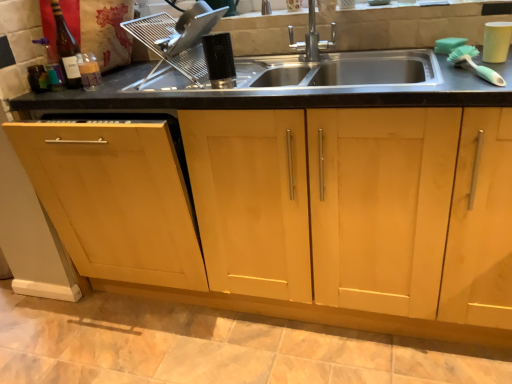
Question: Considering the relative sizes of translucent glass bottle at upper left and satin silver dish rack at upper center, acting as the first appliance starting from the left, in the image provided, is translucent glass bottle at upper left wider than satin silver dish rack at upper center, acting as the first appliance starting from the left,?

Choices:
 (A) no
 (B) yes

Answer: (A)

Question: Does translucent glass bottle at upper left appear on the right side of satin silver dish rack at upper center, which is the 3th appliance from right to left?

Choices:
 (A) no
 (B) yes

Answer: (A)

Question: From the image's perspective, is translucent glass bottle at upper left below satin silver dish rack at upper center, acting as the first appliance starting from the left?

Choices:
 (A) no
 (B) yes

Answer: (B)

Question: From the image's perspective, is translucent glass bottle at upper left over satin silver dish rack at upper center, acting as the first appliance starting from the left?

Choices:
 (A) yes
 (B) no

Answer: (B)

Question: Is translucent glass bottle at upper left beside satin silver dish rack at upper center, which is the 3th appliance from right to left?

Choices:
 (A) no
 (B) yes

Answer: (A)

Question: Is satin silver dish rack at upper center, which is the 3th appliance from right to left, inside or outside of black plastic comb at center, positioned as the 2th appliance in left-to-right order?

Choices:
 (A) outside
 (B) inside

Answer: (A)

Question: Is satin silver dish rack at upper center, which is the 3th appliance from right to left, to the left or to the right of black plastic comb at center, which is counted as the second appliance, starting from the right, in the image?

Choices:
 (A) left
 (B) right

Answer: (A)

Question: Considering the positions of point (186, 11) and point (218, 61), is point (186, 11) closer or farther from the camera than point (218, 61)?

Choices:
 (A) farther
 (B) closer

Answer: (B)

Question: Considering their positions, is satin silver dish rack at upper center, acting as the first appliance starting from the left, located in front of or behind black plastic comb at center, which is counted as the second appliance, starting from the right?

Choices:
 (A) behind
 (B) front

Answer: (A)

Question: In terms of width, does black plastic comb at center, which is counted as the second appliance, starting from the right, look wider or thinner when compared to white matte cup at upper right, the 3th appliance positioned from the left?

Choices:
 (A) thin
 (B) wide

Answer: (B)

Question: From the image's perspective, is black plastic comb at center, which is counted as the second appliance, starting from the right, above or below white matte cup at upper right, the 3th appliance positioned from the left?

Choices:
 (A) above
 (B) below

Answer: (B)

Question: From a real-world perspective, is black plastic comb at center, which is counted as the second appliance, starting from the right, above or below white matte cup at upper right, the 3th appliance positioned from the left?

Choices:
 (A) below
 (B) above

Answer: (B)

Question: Considering their positions, is black plastic comb at center, which is counted as the second appliance, starting from the right, located in front of or behind white matte cup at upper right, the first appliance positioned from the right?

Choices:
 (A) behind
 (B) front

Answer: (A)

Question: In the image, is satin silver dish rack at upper center, which is the 3th appliance from right to left, on the left side or the right side of light wood cabinet at center?

Choices:
 (A) left
 (B) right

Answer: (A)

Question: Is satin silver dish rack at upper center, acting as the first appliance starting from the left, taller or shorter than light wood cabinet at center?

Choices:
 (A) short
 (B) tall

Answer: (A)